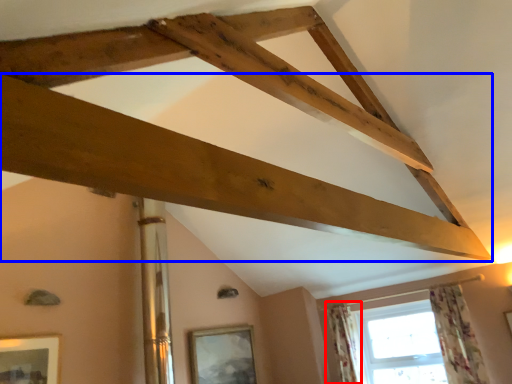
Question: Among these objects, which one is farthest to the camera, curtain (highlighted by a red box) or plank (highlighted by a blue box)?

Choices:
 (A) curtain
 (B) plank

Answer: (A)